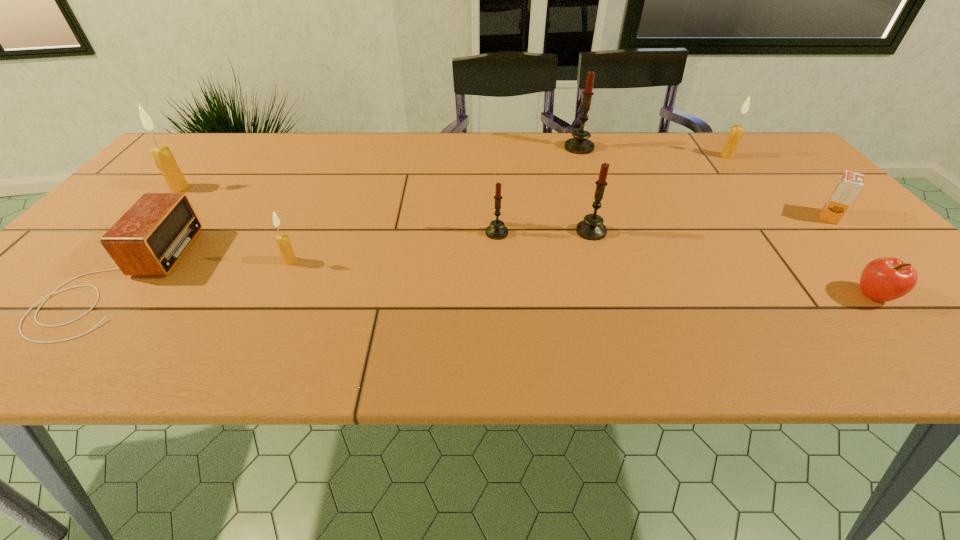
At what (x,y) coordinates should I click in order to perform the action: click on object that is at the left edge. Please return your answer as a coordinate pair (x, y). Looking at the image, I should click on (163, 157).

Locate an element on the screen. candle that is positioned at the right edge is located at coordinates (736, 132).

The image size is (960, 540). In order to click on orange juice that is at the right edge in this screenshot , I will do `click(849, 185)`.

Locate an element on the screen. This screenshot has height=540, width=960. apple that is at the right edge is located at coordinates (885, 279).

Where is `object that is at the far right corner`? object that is at the far right corner is located at coordinates (736, 132).

You are a GUI agent. You are given a task and a screenshot of the screen. Output one action in this format:
    pyautogui.click(x=<x>, y=<y>)
    Task: Click on the vacant space at the far edge of the desktop
    
    Given the screenshot: What is the action you would take?
    pyautogui.click(x=461, y=160)

This screenshot has width=960, height=540. What are the coordinates of `free location at the near edge of the desktop` in the screenshot? It's located at (751, 359).

Locate an element on the screen. The height and width of the screenshot is (540, 960). free location at the left edge is located at coordinates (167, 190).

In the image, there is a desktop. At what (x,y) coordinates should I click in order to perform the action: click on vacant space at the right edge. Please return your answer as a coordinate pair (x, y). Looking at the image, I should click on (826, 268).

Identify the location of vacant area at the far left corner. tap(196, 169).